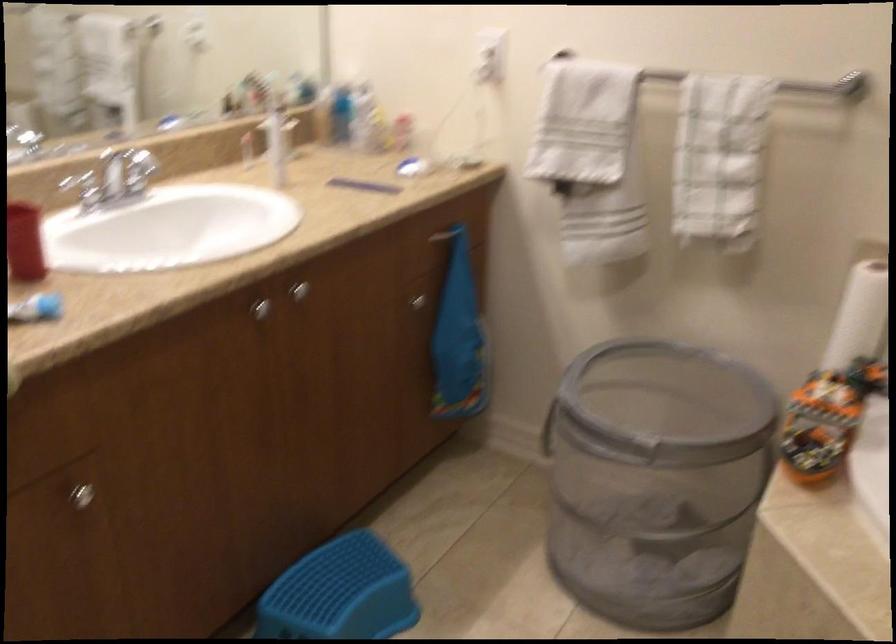
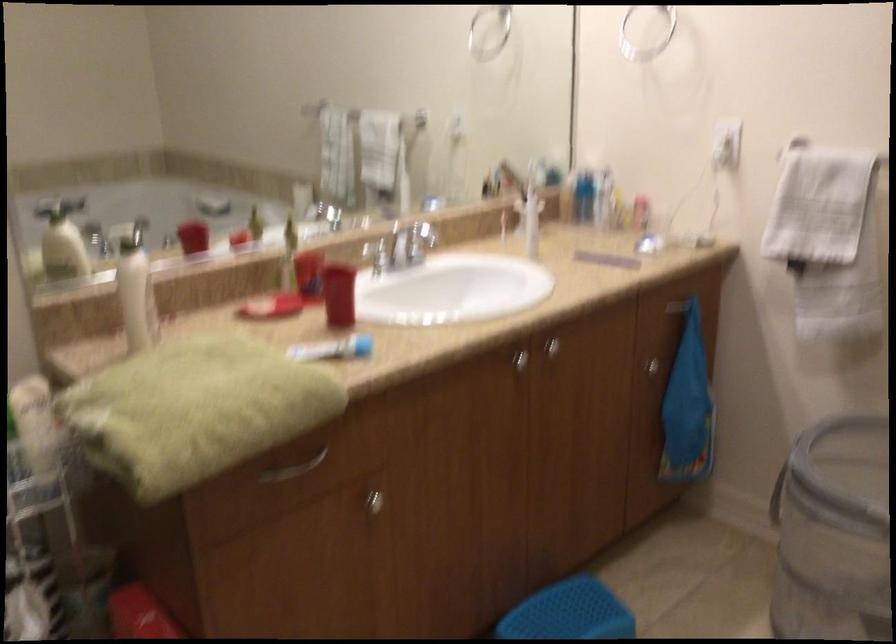
The point at (260, 308) is marked in the first image. Where is the corresponding point in the second image?

(519, 360)